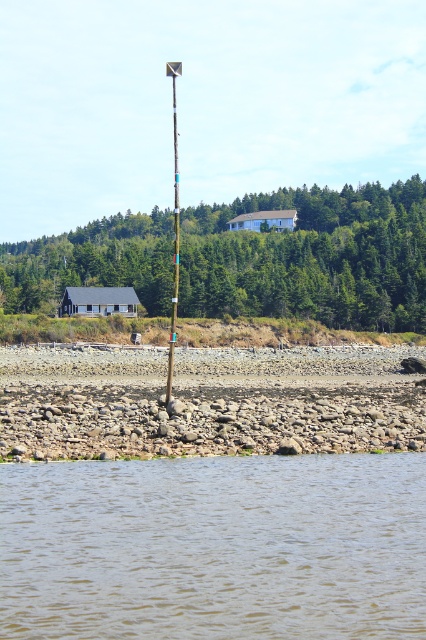
Does brown water at lower center appear over green textured tree at upper center?

Actually, brown water at lower center is below green textured tree at upper center.

Between brown water at lower center and green textured tree at upper center, which one appears on the left side from the viewer's perspective?

From the viewer's perspective, brown water at lower center appears more on the left side.

Image resolution: width=426 pixels, height=640 pixels. I want to click on brown water at lower center, so click(215, 548).

Which is in front, point (86, 513) or point (175, 180)?

Point (86, 513)

Does brown water at lower center have a lesser width compared to metallic silver pole at center?

Yes, brown water at lower center is thinner than metallic silver pole at center.

Between point (25, 608) and point (178, 268), which one is positioned behind?

The point (178, 268) is behind.

You are a GUI agent. You are given a task and a screenshot of the screen. Output one action in this format:
    pyautogui.click(x=<x>, y=<y>)
    Task: Click on the brown water at lower center
    
    Given the screenshot: What is the action you would take?
    pyautogui.click(x=215, y=548)

Does point (94, 253) come farther from viewer compared to point (169, 72)?

No, (94, 253) is in front of (169, 72).

You are a GUI agent. You are given a task and a screenshot of the screen. Output one action in this format:
    pyautogui.click(x=<x>, y=<y>)
    Task: Click on the green textured tree at upper center
    This screenshot has height=640, width=426.
    Given the screenshot: What is the action you would take?
    pyautogui.click(x=311, y=257)

At what (x,y) coordinates should I click in order to perform the action: click on green textured tree at upper center. Please return your answer as a coordinate pair (x, y). The image size is (426, 640). Looking at the image, I should click on (311, 257).

Locate an element on the screen. This screenshot has width=426, height=640. green textured tree at upper center is located at coordinates (311, 257).